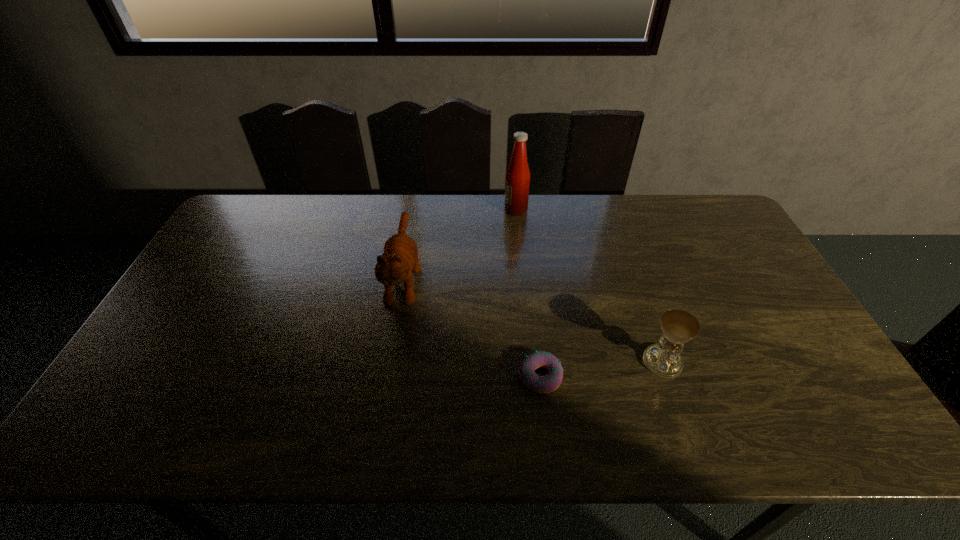
Locate an element on the screen. The image size is (960, 540). vacant space that satisfies the following two spatial constraints: 1. on the face of the second tallest object; 2. on the right side of the second shortest object is located at coordinates (389, 362).

Image resolution: width=960 pixels, height=540 pixels. I want to click on vacant space that satisfies the following two spatial constraints: 1. on the front-facing side of the farthest object; 2. on the right side of the doughnut, so click(532, 376).

At what (x,y) coordinates should I click in order to perform the action: click on free space that satisfies the following two spatial constraints: 1. on the front-facing side of the tallest object; 2. on the face of the second tallest object. Please return your answer as a coordinate pair (x, y). This screenshot has width=960, height=540. Looking at the image, I should click on (522, 276).